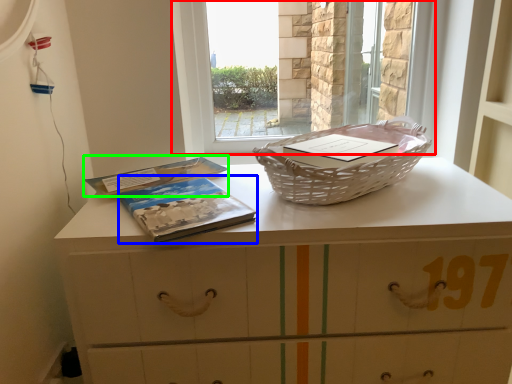
Question: Estimate the real-world distances between objects in this image. Which object is closer to window (highlighted by a red box), paperback book (highlighted by a blue box) or paperback book (highlighted by a green box)?

Choices:
 (A) paperback book
 (B) paperback book

Answer: (B)